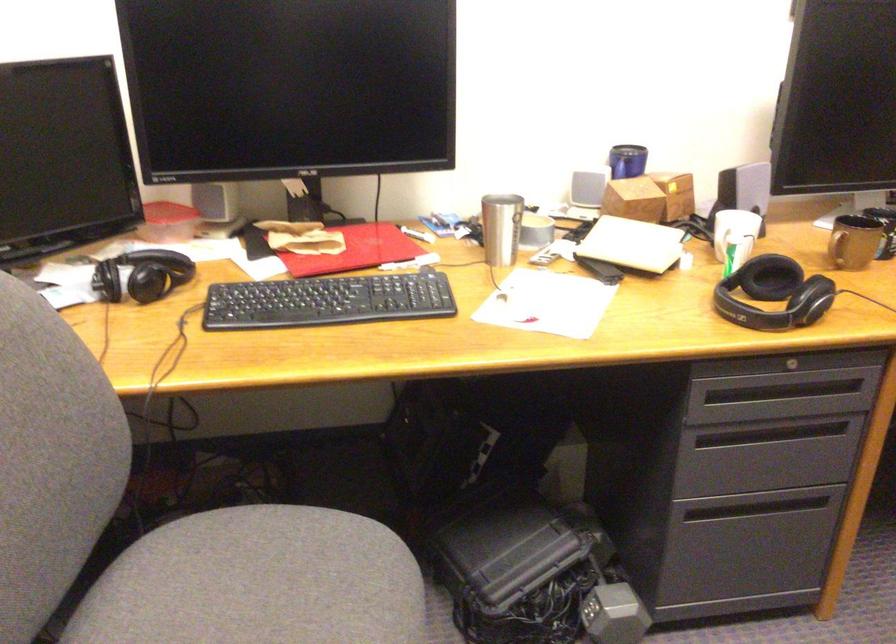
I want to click on black headphones, so click(810, 299).